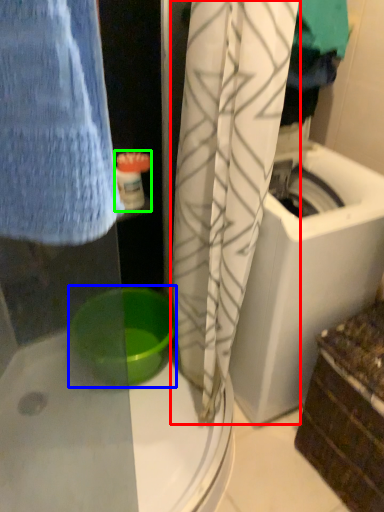
Question: Based on their relative distances, which object is farther from curtain (highlighted by a red box)? Choose from basin (highlighted by a blue box) and toiletry (highlighted by a green box).

Choices:
 (A) basin
 (B) toiletry

Answer: (B)